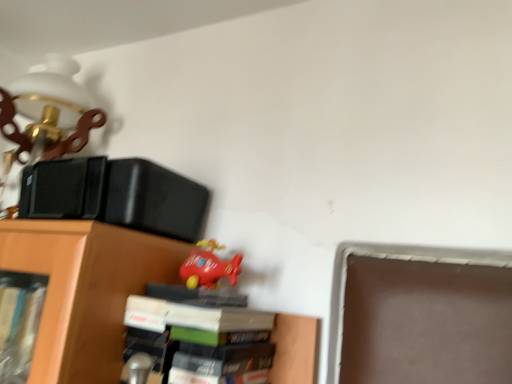
Question: Which is correct: rubberized red airplane at upper center is inside hardcover book at center, or outside of it?

Choices:
 (A) outside
 (B) inside

Answer: (A)

Question: In the image, is rubberized red airplane at upper center positioned in front of or behind hardcover book at center?

Choices:
 (A) front
 (B) behind

Answer: (B)

Question: Considering the positions of rubberized red airplane at upper center and hardcover book at center in the image, is rubberized red airplane at upper center bigger or smaller than hardcover book at center?

Choices:
 (A) small
 (B) big

Answer: (A)

Question: Is hardcover book at center taller or shorter than rubberized red airplane at upper center?

Choices:
 (A) short
 (B) tall

Answer: (B)

Question: Based on their sizes in the image, would you say hardcover book at center is bigger or smaller than rubberized red airplane at upper center?

Choices:
 (A) big
 (B) small

Answer: (A)

Question: Would you say hardcover book at center is inside or outside rubberized red airplane at upper center?

Choices:
 (A) inside
 (B) outside

Answer: (B)

Question: Does point (228, 367) appear closer or farther from the camera than point (197, 284)?

Choices:
 (A) closer
 (B) farther

Answer: (A)